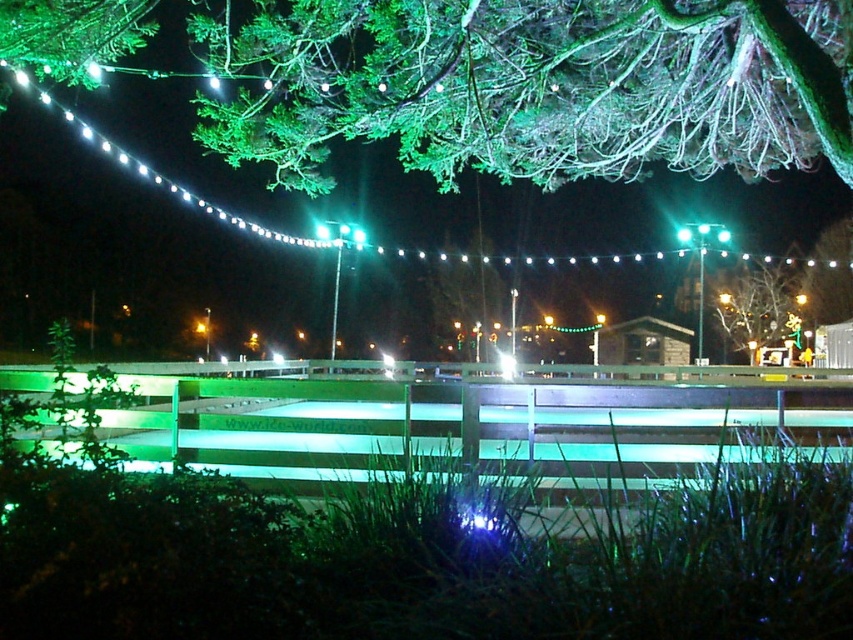
You are a drone operator tasked with flying a drone between the green leafy branches at upper center and the green matte tree at upper center. The drone has a maximum flight distance of 30 meters. Can the drone safely fly between them without exceeding its range?

The distance between the green leafy branches at upper center and the green matte tree at upper center is 36.87 meters, which exceeds the drone operator has a maximum flight distance of 30 meters. The drone cannot safely fly between them without exceeding its range.

You are standing in the scene and want to locate the green leafy branches at upper center. What are their coordinates?

The green leafy branches at upper center are located at coordinates point (x=534, y=84).

You are standing in the garden and notice the green leafy branches at upper center and the green matte tree at upper center. Which object is closer to you?

The green leafy branches at upper center is in front of the green matte tree at upper center, so it is closer to you.